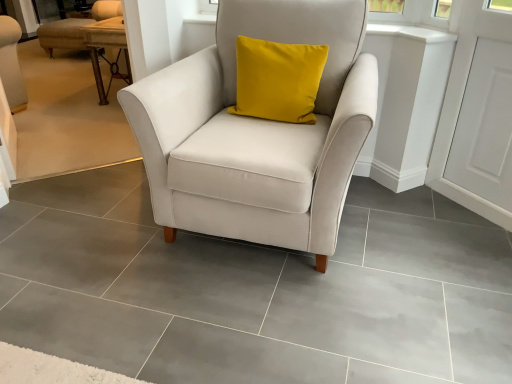
This screenshot has height=384, width=512. What do you see at coordinates (411, 33) in the screenshot? I see `white smooth window sill at upper center` at bounding box center [411, 33].

What do you see at coordinates (104, 47) in the screenshot? I see `wooden textured table at upper left` at bounding box center [104, 47].

Locate an element on the screen. white smooth window sill at upper center is located at coordinates (411, 33).

Is satin white armchair at center bigger or smaller than wooden textured table at upper left?

Considering their sizes, satin white armchair at center takes up more space than wooden textured table at upper left.

Between satin white armchair at center and wooden textured table at upper left, which one has less height?

wooden textured table at upper left is shorter.

Locate an element on the screen. This screenshot has height=384, width=512. table below the satin white armchair at center (from a real-world perspective) is located at coordinates pyautogui.click(x=104, y=47).

Is satin white armchair at center located outside wooden textured table at upper left?

Yes, satin white armchair at center is outside of wooden textured table at upper left.

From the image's perspective, between white smooth window sill at upper center and wooden textured table at upper left, which one is located above?

wooden textured table at upper left is shown above in the image.

From a real-world perspective, which object stands above the other?

From a 3D spatial view, white smooth window sill at upper center is above.

Is white smooth window sill at upper center wider or thinner than wooden textured table at upper left?

In the image, white smooth window sill at upper center appears to be more narrow than wooden textured table at upper left.

Considering the positions of objects satin white armchair at center and white smooth window sill at upper center in the image provided, who is in front, satin white armchair at center or white smooth window sill at upper center?

satin white armchair at center is more forward.

Which of these two, satin white armchair at center or white smooth window sill at upper center, is bigger?

With larger size is satin white armchair at center.

Is satin white armchair at center next to white smooth window sill at upper center and touching it?

No, satin white armchair at center is not making contact with white smooth window sill at upper center.

Considering the sizes of objects satin white armchair at center and white smooth window sill at upper center in the image provided, who is taller, satin white armchair at center or white smooth window sill at upper center?

satin white armchair at center.

Which is more to the right, wooden textured table at upper left or white smooth window sill at upper center?

white smooth window sill at upper center is more to the right.

Are wooden textured table at upper left and white smooth window sill at upper center located far from each other?

wooden textured table at upper left is far away from white smooth window sill at upper center.

How much distance is there between wooden textured table at upper left and white smooth window sill at upper center?

wooden textured table at upper left and white smooth window sill at upper center are 2.22 meters apart.

The width and height of the screenshot is (512, 384). In order to click on window sill in front of the wooden textured table at upper left in this screenshot , I will do `click(411, 33)`.

Consider the image. Does wooden textured table at upper left turn towards satin white armchair at center?

No.

Looking at this image, what's the angular difference between wooden textured table at upper left and satin white armchair at center's facing directions?

There is a 90.7-degree angle between the facing directions of wooden textured table at upper left and satin white armchair at center.

From the image's perspective, which one is positioned lower, wooden textured table at upper left or satin white armchair at center?

satin white armchair at center.

Are wooden textured table at upper left and satin white armchair at center located far from each other?

wooden textured table at upper left is far away from satin white armchair at center.

Is white smooth window sill at upper center positioned with its back to satin white armchair at center?

No, white smooth window sill at upper center's orientation is not away from satin white armchair at center.

Who is bigger, white smooth window sill at upper center or satin white armchair at center?

satin white armchair at center is bigger.

Choose the correct answer: Is white smooth window sill at upper center inside satin white armchair at center or outside it?

white smooth window sill at upper center is not inside satin white armchair at center, it's outside.

Identify the location of table on the left of satin white armchair at center. (104, 47).

The height and width of the screenshot is (384, 512). In order to click on table behind the white smooth window sill at upper center in this screenshot , I will do `click(104, 47)`.

Estimate the real-world distances between objects in this image. Which object is closer to wooden textured table at upper left, white smooth window sill at upper center or satin white armchair at center?

satin white armchair at center.

Looking at the image, which one is located further to white smooth window sill at upper center, wooden textured table at upper left or satin white armchair at center?

wooden textured table at upper left is further to white smooth window sill at upper center.

Looking at this image, which object lies nearer to the anchor point satin white armchair at center, wooden textured table at upper left or white smooth window sill at upper center?

Based on the image, white smooth window sill at upper center appears to be nearer to satin white armchair at center.

Looking at the image, which one is located further to wooden textured table at upper left, satin white armchair at center or white smooth window sill at upper center?

white smooth window sill at upper center lies further to wooden textured table at upper left than the other object.

Which object lies further to the anchor point white smooth window sill at upper center, satin white armchair at center or wooden textured table at upper left?

wooden textured table at upper left is positioned further to the anchor white smooth window sill at upper center.

Estimate the real-world distances between objects in this image. Which object is closer to satin white armchair at center, white smooth window sill at upper center or wooden textured table at upper left?

The object closer to satin white armchair at center is white smooth window sill at upper center.

Identify the location of window sill between satin white armchair at center and wooden textured table at upper left along the z-axis. This screenshot has height=384, width=512. (411, 33).